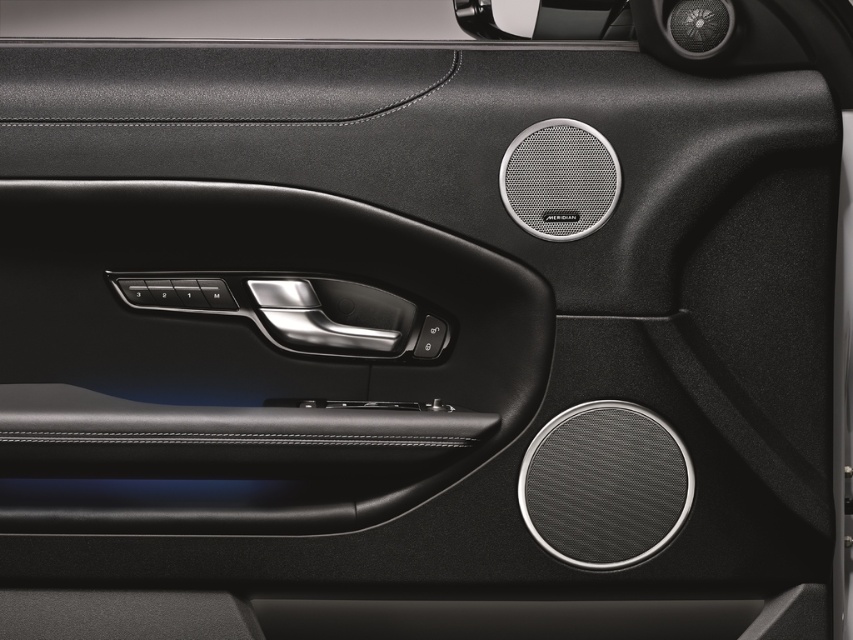
Can you confirm if black leather door handle at center is positioned to the left of black metallic door handle at center?

Yes, black leather door handle at center is to the left of black metallic door handle at center.

The width and height of the screenshot is (853, 640). Find the location of `black leather door handle at center`. black leather door handle at center is located at coordinates pos(245,358).

Image resolution: width=853 pixels, height=640 pixels. I want to click on black leather door handle at center, so click(245, 358).